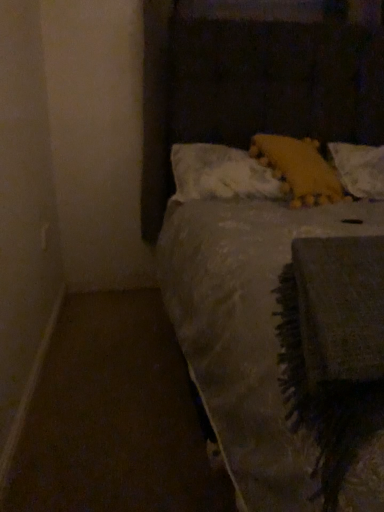
Where is `yellow fuzzy pillow at upper right, which appears as the second pillow when viewed from the right`? The height and width of the screenshot is (512, 384). yellow fuzzy pillow at upper right, which appears as the second pillow when viewed from the right is located at coordinates (299, 169).

Is yellow fuzzy pillow at upper right, acting as the 2th pillow starting from the left, further to camera compared to white fluffy pillow at upper center, the third pillow in the right-to-left sequence?

No.

From the image's perspective, is yellow fuzzy pillow at upper right, which appears as the second pillow when viewed from the right, located above or below white fluffy pillow at upper center, the third pillow in the right-to-left sequence?

Based on their image positions, yellow fuzzy pillow at upper right, which appears as the second pillow when viewed from the right, is located above white fluffy pillow at upper center, the third pillow in the right-to-left sequence.

Which is closer, [271,137] or [256,166]?

Point [271,137].

Which object is positioned more to the right, yellow fuzzy pillow at upper right, acting as the 2th pillow starting from the left, or white fluffy pillow at upper center, the third pillow in the right-to-left sequence?

From the viewer's perspective, yellow fuzzy pillow at upper right, acting as the 2th pillow starting from the left, appears more on the right side.

Is yellow fuzzy pillow at upper right, which appears as the second pillow when viewed from the right, beside yellow fabric pillow at upper right, marked as the 1th pillow in a right-to-left arrangement?

No, yellow fuzzy pillow at upper right, which appears as the second pillow when viewed from the right, is not next to yellow fabric pillow at upper right, marked as the 1th pillow in a right-to-left arrangement.

Locate an element on the screen. the 2nd pillow behind the yellow fuzzy pillow at upper right, acting as the 2th pillow starting from the left is located at coordinates (359, 169).

Consider the image. Is yellow fuzzy pillow at upper right, acting as the 2th pillow starting from the left, in front of or behind yellow fabric pillow at upper right, the third pillow viewed from the left, in the image?

yellow fuzzy pillow at upper right, acting as the 2th pillow starting from the left, is in front of yellow fabric pillow at upper right, the third pillow viewed from the left.

Considering the relative sizes of yellow fuzzy pillow at upper right, acting as the 2th pillow starting from the left, and yellow fabric pillow at upper right, marked as the 1th pillow in a right-to-left arrangement, in the image provided, is yellow fuzzy pillow at upper right, acting as the 2th pillow starting from the left, shorter than yellow fabric pillow at upper right, marked as the 1th pillow in a right-to-left arrangement,?

No, yellow fuzzy pillow at upper right, acting as the 2th pillow starting from the left, is not shorter than yellow fabric pillow at upper right, marked as the 1th pillow in a right-to-left arrangement.

How far apart are white fluffy pillow at upper center, the third pillow in the right-to-left sequence, and yellow fuzzy pillow at upper right, which appears as the second pillow when viewed from the right?

white fluffy pillow at upper center, the third pillow in the right-to-left sequence, is 6.36 inches from yellow fuzzy pillow at upper right, which appears as the second pillow when viewed from the right.

Could yellow fuzzy pillow at upper right, acting as the 2th pillow starting from the left, be considered to be inside white fluffy pillow at upper center, the third pillow in the right-to-left sequence?

That's correct, yellow fuzzy pillow at upper right, acting as the 2th pillow starting from the left, is inside white fluffy pillow at upper center, the third pillow in the right-to-left sequence.

Considering the relative sizes of white fluffy pillow at upper center, which is the first pillow in left-to-right order, and yellow fuzzy pillow at upper right, which appears as the second pillow when viewed from the right, in the image provided, is white fluffy pillow at upper center, which is the first pillow in left-to-right order, wider than yellow fuzzy pillow at upper right, which appears as the second pillow when viewed from the right,?

Incorrect, the width of white fluffy pillow at upper center, which is the first pillow in left-to-right order, does not surpass that of yellow fuzzy pillow at upper right, which appears as the second pillow when viewed from the right.

Who is bigger, white fluffy pillow at upper center, which is the first pillow in left-to-right order, or yellow fuzzy pillow at upper right, acting as the 2th pillow starting from the left?

white fluffy pillow at upper center, which is the first pillow in left-to-right order, is bigger.

Is white fluffy pillow at upper center, the third pillow in the right-to-left sequence, directly adjacent to yellow fabric pillow at upper right, the third pillow viewed from the left?

white fluffy pillow at upper center, the third pillow in the right-to-left sequence, and yellow fabric pillow at upper right, the third pillow viewed from the left, are clearly separated.

Is white fluffy pillow at upper center, which is the first pillow in left-to-right order, positioned behind yellow fabric pillow at upper right, the third pillow viewed from the left?

No, white fluffy pillow at upper center, which is the first pillow in left-to-right order, is closer to the viewer.

Is white fluffy pillow at upper center, which is the first pillow in left-to-right order, positioned with its back to yellow fabric pillow at upper right, the third pillow viewed from the left?

That's not correct — white fluffy pillow at upper center, which is the first pillow in left-to-right order, is not looking away from yellow fabric pillow at upper right, the third pillow viewed from the left.

Is yellow fabric pillow at upper right, marked as the 1th pillow in a right-to-left arrangement, wider than white fluffy pillow at upper center, the third pillow in the right-to-left sequence?

Correct, the width of yellow fabric pillow at upper right, marked as the 1th pillow in a right-to-left arrangement, exceeds that of white fluffy pillow at upper center, the third pillow in the right-to-left sequence.

Is yellow fabric pillow at upper right, marked as the 1th pillow in a right-to-left arrangement, placed right next to white fluffy pillow at upper center, the third pillow in the right-to-left sequence?

They are not placed beside each other.

From their relative heights in the image, would you say yellow fabric pillow at upper right, marked as the 1th pillow in a right-to-left arrangement, is taller or shorter than white fluffy pillow at upper center, which is the first pillow in left-to-right order?

Clearly, yellow fabric pillow at upper right, marked as the 1th pillow in a right-to-left arrangement, is taller compared to white fluffy pillow at upper center, which is the first pillow in left-to-right order.

Is white fluffy pillow at upper center, the third pillow in the right-to-left sequence, completely or partially inside yellow fabric pillow at upper right, marked as the 1th pillow in a right-to-left arrangement?

No, white fluffy pillow at upper center, the third pillow in the right-to-left sequence, is not a part of yellow fabric pillow at upper right, marked as the 1th pillow in a right-to-left arrangement.

How different are the orientations of yellow fabric pillow at upper right, the third pillow viewed from the left, and yellow fuzzy pillow at upper right, acting as the 2th pillow starting from the left, in degrees?

→ The facing directions of yellow fabric pillow at upper right, the third pillow viewed from the left, and yellow fuzzy pillow at upper right, acting as the 2th pillow starting from the left, are 18.1 degrees apart.

Is yellow fabric pillow at upper right, the third pillow viewed from the left, surrounding yellow fuzzy pillow at upper right, acting as the 2th pillow starting from the left?

No, yellow fabric pillow at upper right, the third pillow viewed from the left, does not contain yellow fuzzy pillow at upper right, acting as the 2th pillow starting from the left.

From the image's perspective, which pillow is the 1st one below the yellow fuzzy pillow at upper right, which appears as the second pillow when viewed from the right? Please provide its 2D coordinates.

[(359, 169)]

Image resolution: width=384 pixels, height=512 pixels. Identify the location of pillow that appears on the left of yellow fuzzy pillow at upper right, which appears as the second pillow when viewed from the right. tap(220, 174).

Locate an element on the screen. This screenshot has height=512, width=384. the 2nd pillow behind the yellow fuzzy pillow at upper right, acting as the 2th pillow starting from the left is located at coordinates (359, 169).

Which object lies nearer to the anchor point yellow fuzzy pillow at upper right, which appears as the second pillow when viewed from the right, yellow fabric pillow at upper right, the third pillow viewed from the left, or white fluffy pillow at upper center, which is the first pillow in left-to-right order?

white fluffy pillow at upper center, which is the first pillow in left-to-right order, lies closer to yellow fuzzy pillow at upper right, which appears as the second pillow when viewed from the right, than the other object.

Considering their positions, is white fluffy pillow at upper center, which is the first pillow in left-to-right order, positioned further to yellow fuzzy pillow at upper right, acting as the 2th pillow starting from the left, than yellow fabric pillow at upper right, marked as the 1th pillow in a right-to-left arrangement?

yellow fabric pillow at upper right, marked as the 1th pillow in a right-to-left arrangement, is further to yellow fuzzy pillow at upper right, acting as the 2th pillow starting from the left.

Considering their positions, is white fluffy pillow at upper center, the third pillow in the right-to-left sequence, positioned further to yellow fabric pillow at upper right, marked as the 1th pillow in a right-to-left arrangement, than yellow fuzzy pillow at upper right, which appears as the second pillow when viewed from the right?

Among the two, white fluffy pillow at upper center, the third pillow in the right-to-left sequence, is located further to yellow fabric pillow at upper right, marked as the 1th pillow in a right-to-left arrangement.

From the image, which object appears to be farther from yellow fabric pillow at upper right, the third pillow viewed from the left, yellow fuzzy pillow at upper right, which appears as the second pillow when viewed from the right, or white fluffy pillow at upper center, the third pillow in the right-to-left sequence?

white fluffy pillow at upper center, the third pillow in the right-to-left sequence, lies further to yellow fabric pillow at upper right, the third pillow viewed from the left, than the other object.

When comparing their distances from white fluffy pillow at upper center, the third pillow in the right-to-left sequence, does yellow fabric pillow at upper right, the third pillow viewed from the left, or yellow fuzzy pillow at upper right, which appears as the second pillow when viewed from the right, seem further?

The object further to white fluffy pillow at upper center, the third pillow in the right-to-left sequence, is yellow fabric pillow at upper right, the third pillow viewed from the left.

Which object lies nearer to the anchor point white fluffy pillow at upper center, the third pillow in the right-to-left sequence, yellow fuzzy pillow at upper right, which appears as the second pillow when viewed from the right, or yellow fabric pillow at upper right, marked as the 1th pillow in a right-to-left arrangement?

yellow fuzzy pillow at upper right, which appears as the second pillow when viewed from the right, lies closer to white fluffy pillow at upper center, the third pillow in the right-to-left sequence, than the other object.

At what (x,y) coordinates should I click in order to perform the action: click on pillow located between white fluffy pillow at upper center, the third pillow in the right-to-left sequence, and yellow fabric pillow at upper right, marked as the 1th pillow in a right-to-left arrangement, in the left-right direction. Please return your answer as a coordinate pair (x, y). This screenshot has height=512, width=384. Looking at the image, I should click on (299, 169).